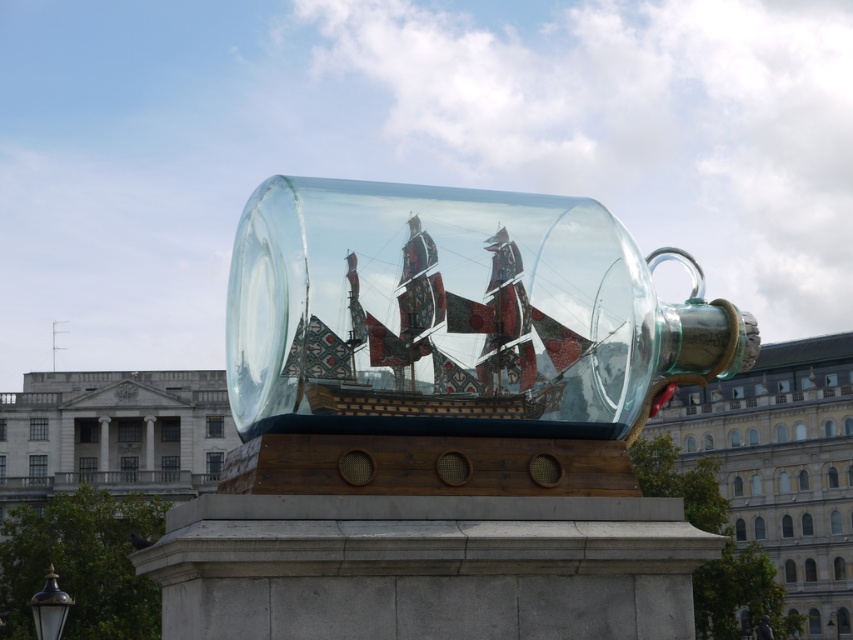
You are an art curator planning to display both the transparent glass ship at center and the polished wooden ship at center in a new exhibition. Given their sizes, which ship should be placed on a wider base to ensure stability?

The transparent glass ship at center has a larger width than the polished wooden ship at center, so it should be placed on a wider base to ensure stability.

You are an art curator planning to move the polished wooden ship at center to a different exhibition hall. To do so, you need to determine its position relative to the transparent glass ship at center. Which direction should you move it to first?

The polished wooden ship at center is behind the transparent glass ship at center, so you should move it forward first to access it.

You are an art curator planning to move the transparent glass ship at center and the polished wooden ship at center to a new exhibition space. If you want to maintain their original relative positions as seen in the image, which ship should be placed to the right side in the new arrangement?

The transparent glass ship at center should be placed to the right of the polished wooden ship at center to maintain their original relative positions as described in the image.